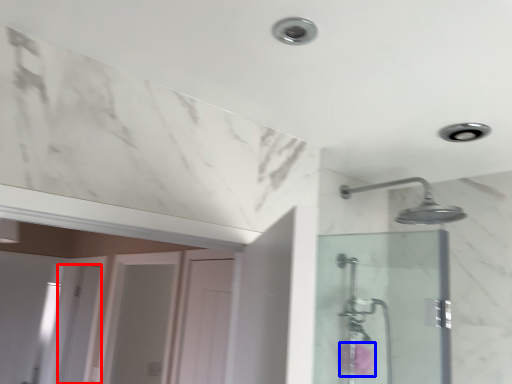
Question: Which of the following is the closest to the observer, screen door (highlighted by a red box) or flower (highlighted by a blue box)?

Choices:
 (A) screen door
 (B) flower

Answer: (B)